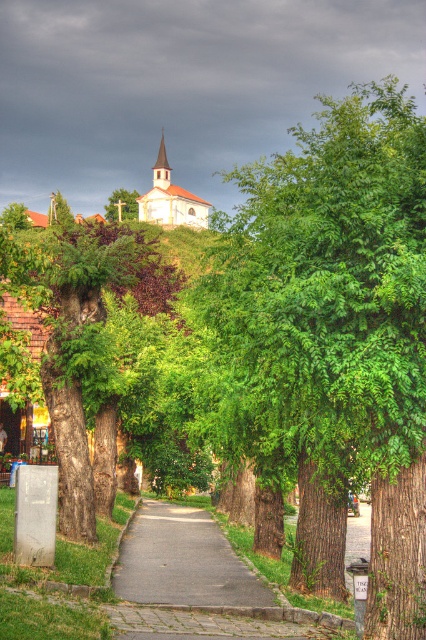
From the picture: You are a gardener planning to plant a new tree along the gray asphalt path at center. Considering the space available, would the new tree have enough room to grow as wide as the green leafy tree at center?

The green leafy tree at center has a larger width than the gray asphalt path at center, so there might not be enough space for the new tree to grow as wide as the existing one without encroaching on the path.

You are standing on the paved pathway and want to walk towards the white matte church at center. Which direction should you turn to avoid the green leafy tree at upper center blocking your path?

You should turn to the right to walk towards the white matte church at center since it is to the right of the green leafy tree at upper center, avoiding the tree blocking your path.

You are a delivery person with a cart that needs to deliver a package to the church ahead. Your cart is 1.8 meters wide. The path is straight. Can your cart pass between the green leafy tree at center and the gray asphalt path at center without hitting the tree?

The green leafy tree at center and gray asphalt path at center are 21.32 meters apart from each other. Since the cart is only 1.8 meters wide, there is more than enough space for the cart to pass safely between them without hitting the tree.